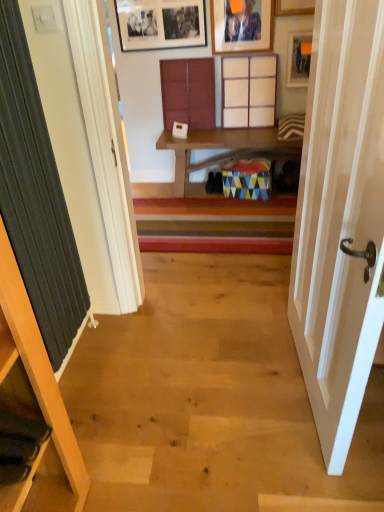
Question: Can you confirm if matte wooden picture frame at upper right, the third picture frame positioned from the left, is wider than matte wooden picture frame at upper center, the 2th picture frame when ordered from left to right?

Choices:
 (A) no
 (B) yes

Answer: (A)

Question: Does matte wooden picture frame at upper right, which is the 1th picture frame in right-to-left order, come behind matte wooden picture frame at upper center, the 2th picture frame when ordered from left to right?

Choices:
 (A) yes
 (B) no

Answer: (A)

Question: From a real-world perspective, is matte wooden picture frame at upper right, the third picture frame positioned from the left, located beneath matte wooden picture frame at upper center, arranged as the second picture frame when viewed from the right?

Choices:
 (A) yes
 (B) no

Answer: (A)

Question: Could you tell me if matte wooden picture frame at upper right, which is the 1th picture frame in right-to-left order, is turned towards matte wooden picture frame at upper center, arranged as the second picture frame when viewed from the right?

Choices:
 (A) yes
 (B) no

Answer: (B)

Question: Is matte wooden picture frame at upper right, the third picture frame positioned from the left, closer to the viewer compared to matte wooden picture frame at upper center, the 2th picture frame when ordered from left to right?

Choices:
 (A) no
 (B) yes

Answer: (A)

Question: From the image's perspective, relative to matte wooden picture frame at upper center, the 2th picture frame when ordered from left to right, is black matte picture frame at upper center, which is the 1th picture frame in left-to-right order, above or below?

Choices:
 (A) above
 (B) below

Answer: (A)

Question: From a real-world perspective, relative to matte wooden picture frame at upper center, arranged as the second picture frame when viewed from the right, is black matte picture frame at upper center, marked as the 3th picture frame in a right-to-left arrangement, vertically above or below?

Choices:
 (A) above
 (B) below

Answer: (A)

Question: Is black matte picture frame at upper center, marked as the 3th picture frame in a right-to-left arrangement, to the left or to the right of matte wooden picture frame at upper center, arranged as the second picture frame when viewed from the right, in the image?

Choices:
 (A) right
 (B) left

Answer: (B)

Question: Is black matte picture frame at upper center, which is the 1th picture frame in left-to-right order, inside the boundaries of matte wooden picture frame at upper center, arranged as the second picture frame when viewed from the right, or outside?

Choices:
 (A) outside
 (B) inside

Answer: (A)

Question: Is point (233, 109) positioned closer to the camera than point (29, 154)?

Choices:
 (A) farther
 (B) closer

Answer: (A)

Question: In the image, is wooden cabinet at upper center, the 3th cabinet in the left-to-right sequence, positioned in front of or behind dark grey ribbed curtain at left?

Choices:
 (A) front
 (B) behind

Answer: (B)

Question: Based on their sizes in the image, would you say wooden cabinet at upper center, which appears as the 2th cabinet when ordered from the bottom, is bigger or smaller than dark grey ribbed curtain at left?

Choices:
 (A) big
 (B) small

Answer: (B)

Question: Is wooden cabinet at upper center, which appears as the 2th cabinet when ordered from the bottom, taller or shorter than dark grey ribbed curtain at left?

Choices:
 (A) tall
 (B) short

Answer: (B)

Question: Do you think black matte picture frame at upper center, which is the 1th picture frame in left-to-right order, is within white wood door at right, or outside of it?

Choices:
 (A) outside
 (B) inside

Answer: (A)

Question: In the image, is black matte picture frame at upper center, marked as the 3th picture frame in a right-to-left arrangement, on the left side or the right side of white wood door at right?

Choices:
 (A) right
 (B) left

Answer: (B)